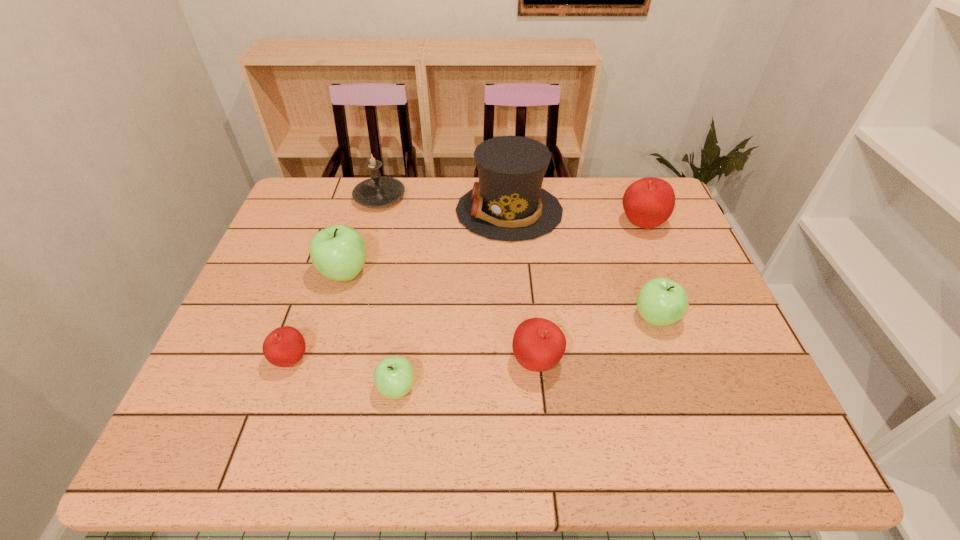
Where is `dress hat`? dress hat is located at coordinates (507, 203).

Locate an element on the screen. candle is located at coordinates (377, 191).

Where is `the rightmost red apple`? the rightmost red apple is located at coordinates (648, 202).

Where is `the biggest red apple`? the biggest red apple is located at coordinates pos(648,202).

Locate an element on the screen. This screenshot has height=540, width=960. the leftmost green apple is located at coordinates (339, 252).

In order to click on the farthest green apple in this screenshot , I will do `click(339, 252)`.

Image resolution: width=960 pixels, height=540 pixels. Identify the location of the second red apple from left to right. (x=538, y=344).

Identify the location of the second smallest red apple. The image size is (960, 540). (538, 344).

Where is `the second biggest green apple`? This screenshot has height=540, width=960. the second biggest green apple is located at coordinates (661, 301).

Where is `the third farthest apple`? The height and width of the screenshot is (540, 960). the third farthest apple is located at coordinates (661, 301).